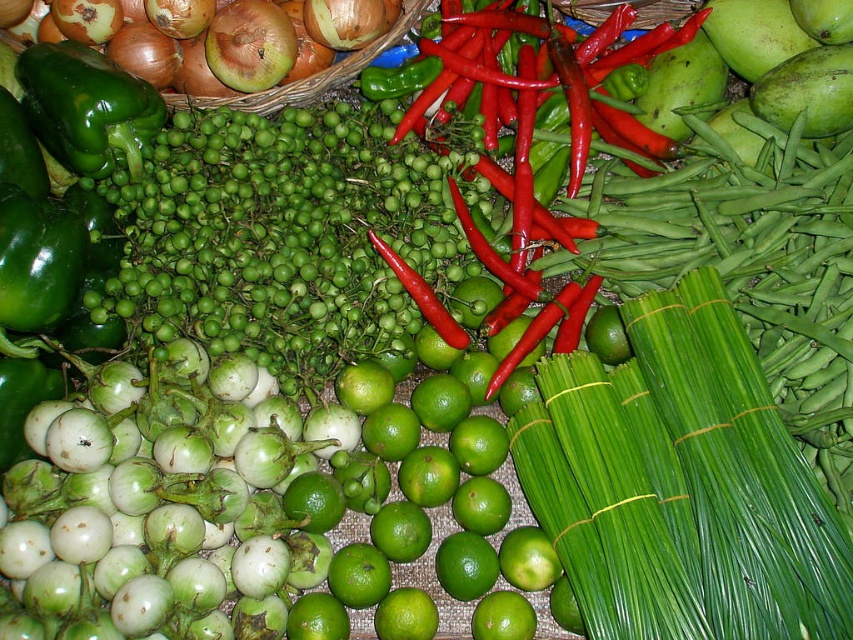
Question: Which object is the closest to the green matte onion at upper left?

Choices:
 (A) green matte bell pepper at upper left
 (B) smooth brown onion at upper left

Answer: (B)

Question: Estimate the real-world distances between objects in this image. Which object is farther from the green matte bell pepper at upper left?

Choices:
 (A) green matte onion at upper left
 (B) brown textured onion at upper left

Answer: (A)

Question: Which of these objects is positioned closest to the brown textured onion at upper left?

Choices:
 (A) smooth brown onion at upper left
 (B) green matte bell pepper at upper left
 (C) green matte onion at upper left

Answer: (C)

Question: Is brown textured onion at upper left below green matte onion at upper left?

Choices:
 (A) no
 (B) yes

Answer: (A)

Question: Is green matte onion at upper left thinner than smooth brown onion at upper left?

Choices:
 (A) no
 (B) yes

Answer: (A)

Question: Can you confirm if green matte onion at upper left is positioned to the left of smooth brown onion at upper left?

Choices:
 (A) yes
 (B) no

Answer: (B)